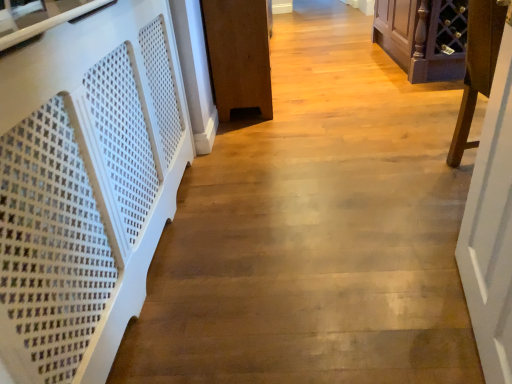
At what (x,y) coordinates should I click in order to perform the action: click on free space that is in between brown wood cabinet at center, which is the 1th furniture from left to right, and white wooden door at right. Please return your answer as a coordinate pair (x, y). Looking at the image, I should click on (330, 188).